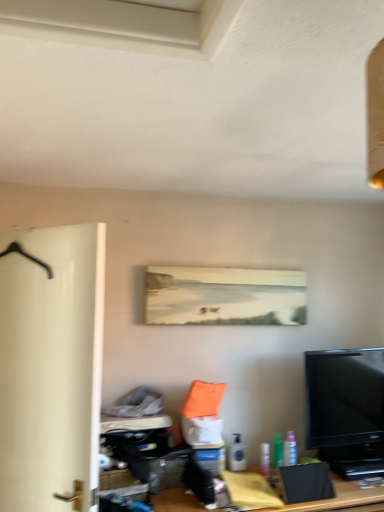
Locate an element on the screen. The image size is (384, 512). free location to the right of translucent plastic spray can at lower center, which appears as the first toiletry when viewed from the left is located at coordinates (252, 469).